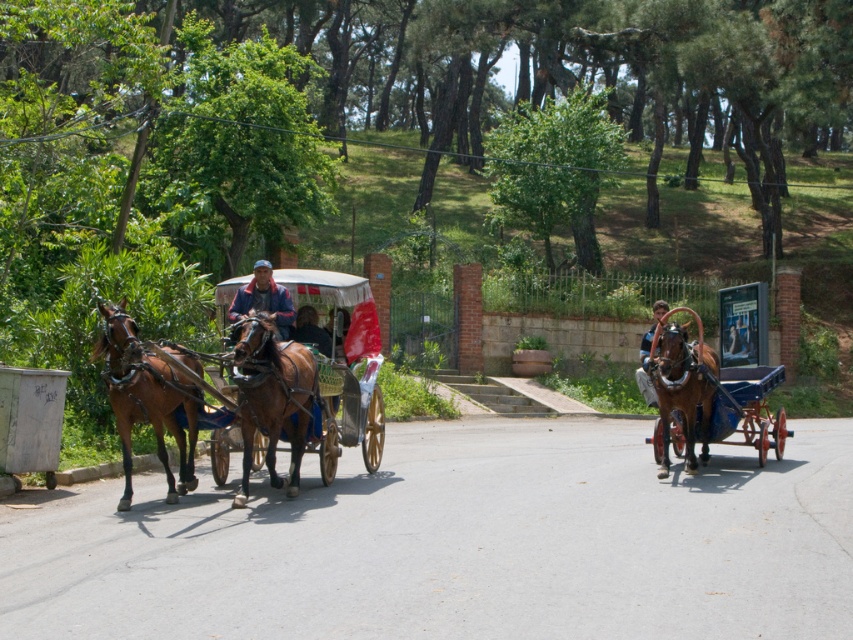
Question: Which point appears closest to the camera in this image?

Choices:
 (A) (653, 404)
 (B) (131, 385)
 (C) (764, 374)
 (D) (706, 416)

Answer: (B)

Question: Is brown glossy horse at left positioned behind smooth brown horse at right?

Choices:
 (A) no
 (B) yes

Answer: (A)

Question: Can you confirm if brown glossy horse at center is positioned below brown glossy horse at right?

Choices:
 (A) no
 (B) yes

Answer: (B)

Question: Which is nearer to the brown glossy horse at right?

Choices:
 (A) shiny brown cart at right
 (B) blue denim jacket at center
 (C) brown glossy horse at left

Answer: (A)

Question: Among these objects, which one is nearest to the camera?

Choices:
 (A) brown glossy horse at left
 (B) dark brown leather jacket at center
 (C) brown glossy horse at right
 (D) shiny brown cart at right

Answer: (A)

Question: Does shiny brown cart at right have a larger size compared to blue denim jacket at center?

Choices:
 (A) yes
 (B) no

Answer: (B)